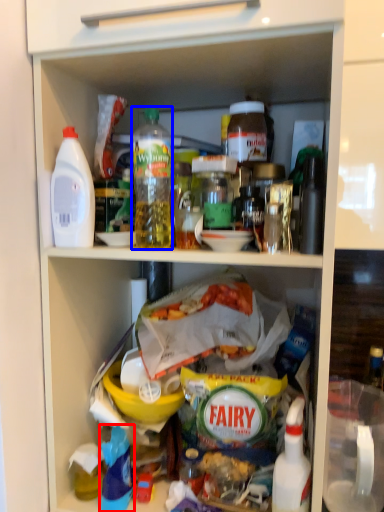
Question: Which object appears farthest to the camera in this image, cleaning product (highlighted by a red box) or bottle (highlighted by a blue box)?

Choices:
 (A) cleaning product
 (B) bottle

Answer: (A)